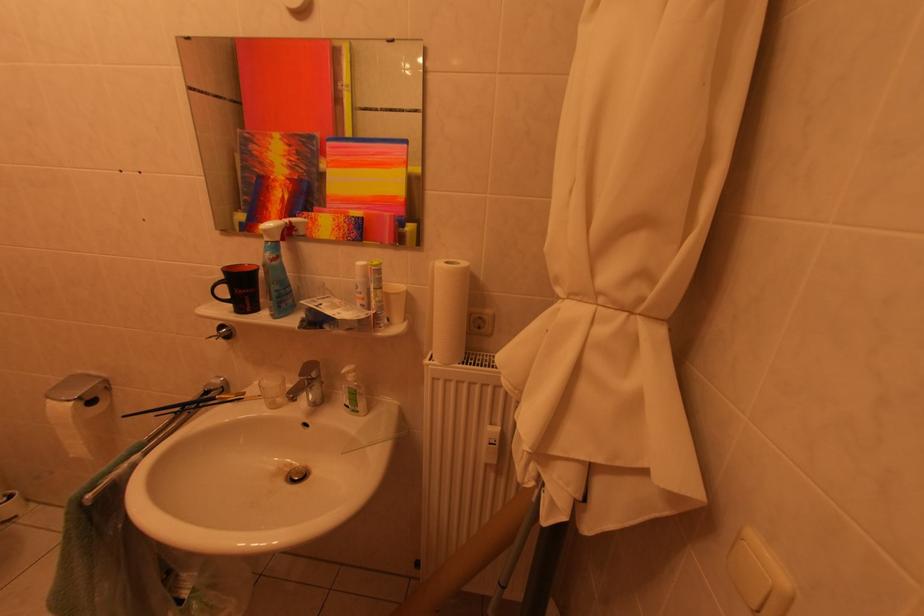
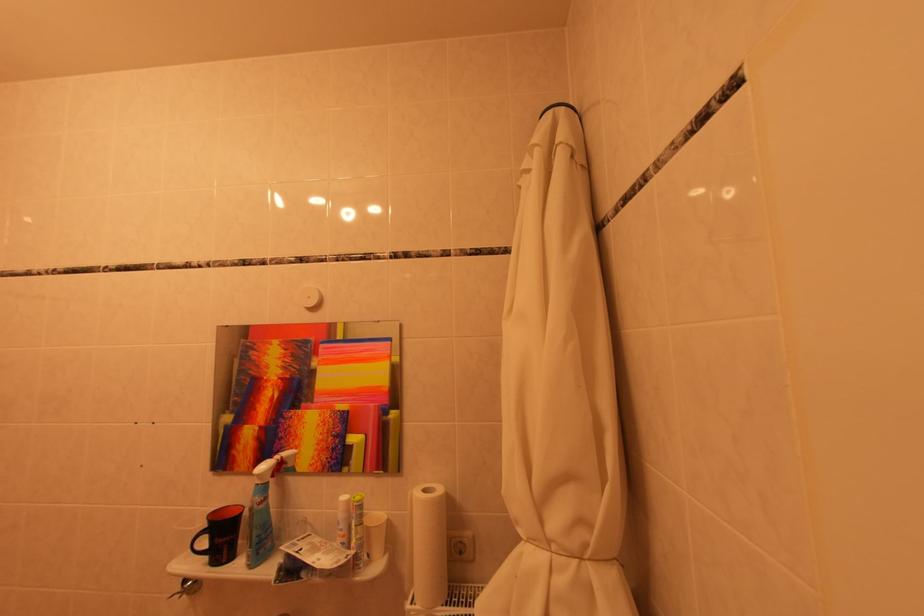
Locate, in the second image, the point that corresponds to (x=299, y=225) in the first image.

(290, 461)